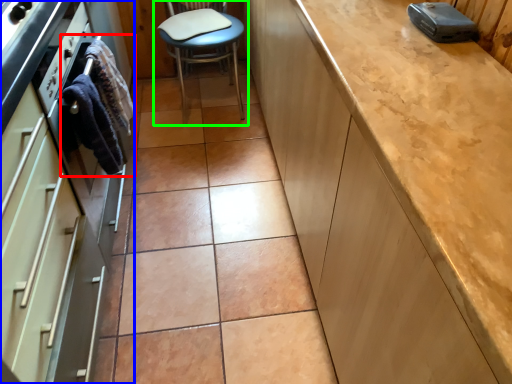
Question: Which object is positioned farthest from material (highlighted by a red box)? Select from cabinetry (highlighted by a blue box) and chair (highlighted by a green box).

Choices:
 (A) cabinetry
 (B) chair

Answer: (B)